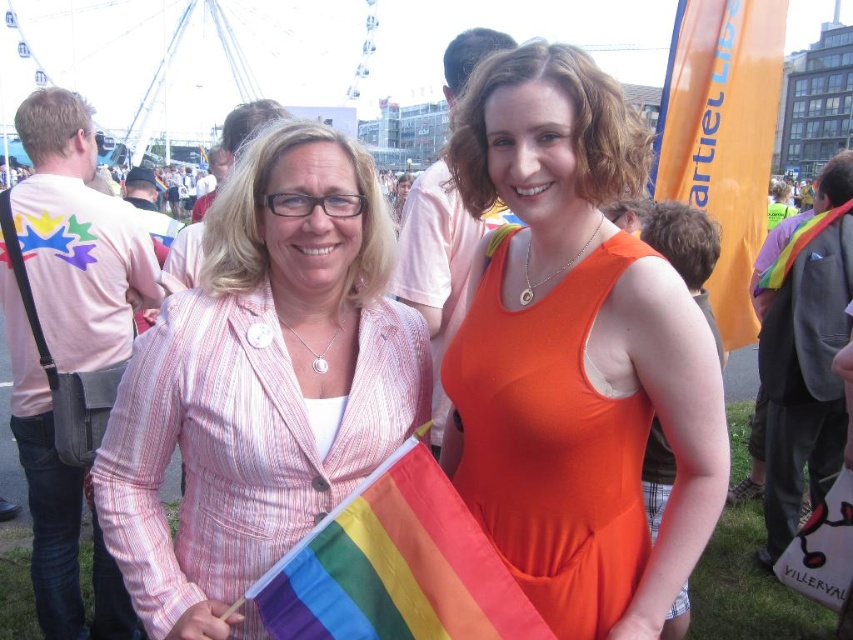
Who is positioned more to the right, orange fabric dress at center or orange fabric flag at upper right?

From the viewer's perspective, orange fabric flag at upper right appears more on the right side.

At what (x,y) coordinates should I click in order to perform the action: click on orange fabric dress at center. Please return your answer as a coordinate pair (x, y). The image size is (853, 640). Looking at the image, I should click on (575, 355).

Identify the location of orange fabric dress at center. (575, 355).

Does orange fabric dress at center appear on the left side of rainbow fabric flag at center?

In fact, orange fabric dress at center is to the right of rainbow fabric flag at center.

What do you see at coordinates (575, 355) in the screenshot? I see `orange fabric dress at center` at bounding box center [575, 355].

Does point (595, 396) lie in front of point (476, 548)?

No, (595, 396) is behind (476, 548).

At what (x,y) coordinates should I click in order to perform the action: click on orange fabric dress at center. Please return your answer as a coordinate pair (x, y). Looking at the image, I should click on (575, 355).

Between pink striped blazer at center and rainbow fabric flag at center, which one appears on the left side from the viewer's perspective?

From the viewer's perspective, pink striped blazer at center appears more on the left side.

Between pink striped blazer at center and rainbow fabric flag at center, which one appears on the right side from the viewer's perspective?

rainbow fabric flag at center

Measure the distance between pink striped blazer at center and camera.

pink striped blazer at center is 28.35 meters away from camera.

The width and height of the screenshot is (853, 640). Identify the location of pink striped blazer at center. (260, 384).